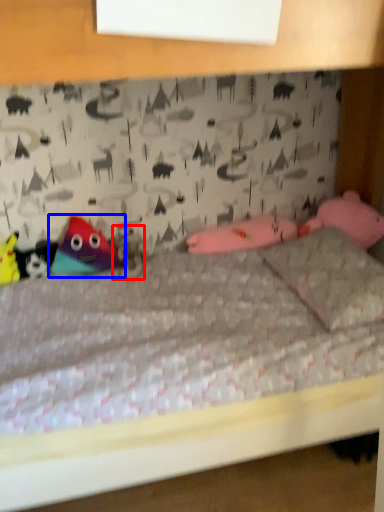
Question: Which of the following is the closest to the observer, animal (highlighted by a red box) or toy (highlighted by a blue box)?

Choices:
 (A) animal
 (B) toy

Answer: (B)